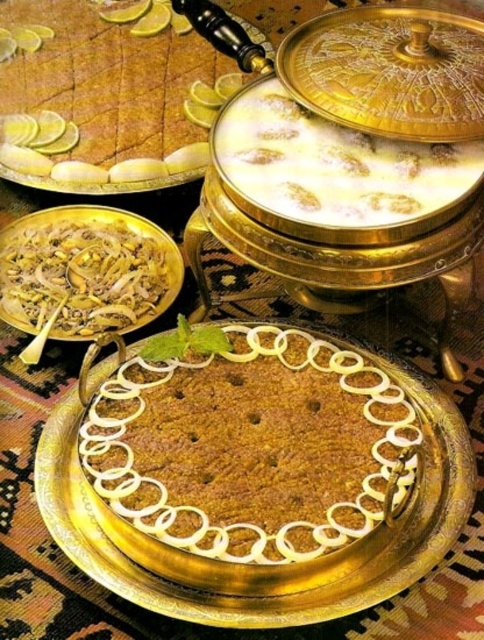
Looking at this image, which of these two, white creamy dessert at center or golden textured cake at center, stands shorter?

white creamy dessert at center

Which is behind, point (341, 208) or point (69, 145)?

The point (69, 145) is more distant.

You are a GUI agent. You are given a task and a screenshot of the screen. Output one action in this format:
    pyautogui.click(x=<x>, y=<y>)
    Task: Click on the white creamy dessert at center
    
    Given the screenshot: What is the action you would take?
    pyautogui.click(x=333, y=164)

The image size is (484, 640). What are the coordinates of `white creamy dessert at center` in the screenshot? It's located at (333, 164).

Is brown crumbly cake at center shorter than golden textured cake at center?

Yes.

Is point (232, 532) positioned before point (46, 29)?

That is True.

Find the location of a particular element. brown crumbly cake at center is located at coordinates (252, 445).

This screenshot has width=484, height=640. What do you see at coordinates (86, 272) in the screenshot? I see `white creamy rice at center` at bounding box center [86, 272].

Between white creamy rice at center and golden textured cake at center, which one has more height?

Standing taller between the two is golden textured cake at center.

The height and width of the screenshot is (640, 484). I want to click on white creamy rice at center, so click(x=86, y=272).